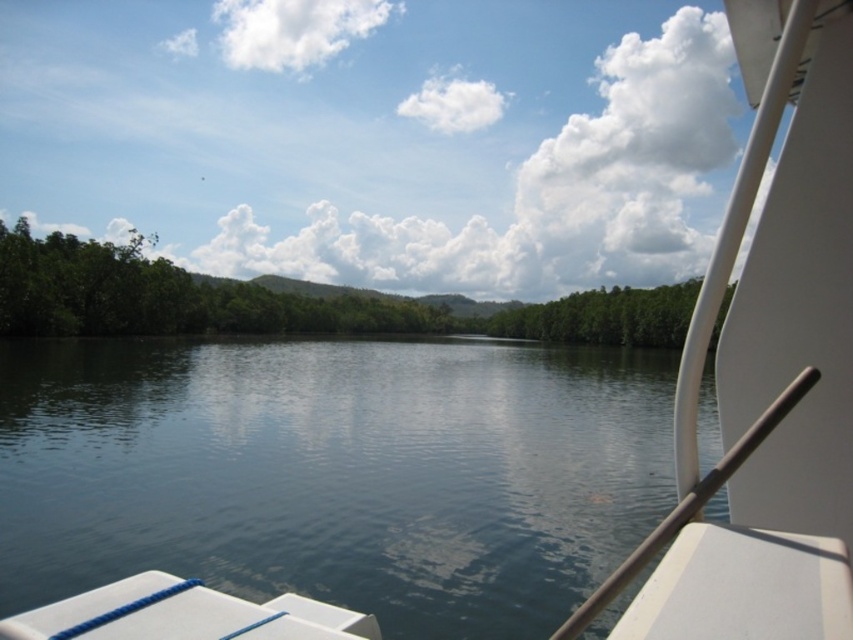
Question: Among these objects, which one is farthest from the camera?

Choices:
 (A) white glossy boat at upper right
 (B) transparent water at center
 (C) green leafy trees at left

Answer: (C)

Question: Is transparent water at center above green leafy trees at left?

Choices:
 (A) yes
 (B) no

Answer: (B)

Question: In this image, where is transparent water at center located relative to green leafy trees at left?

Choices:
 (A) above
 (B) below

Answer: (B)

Question: Which object is positioned closest to the white glossy boat at upper right?

Choices:
 (A) green leafy trees at left
 (B) transparent water at center

Answer: (B)

Question: Among these objects, which one is farthest from the camera?

Choices:
 (A) white glossy boat at upper right
 (B) transparent water at center

Answer: (B)

Question: Is transparent water at center behind green leafy trees at left?

Choices:
 (A) no
 (B) yes

Answer: (A)